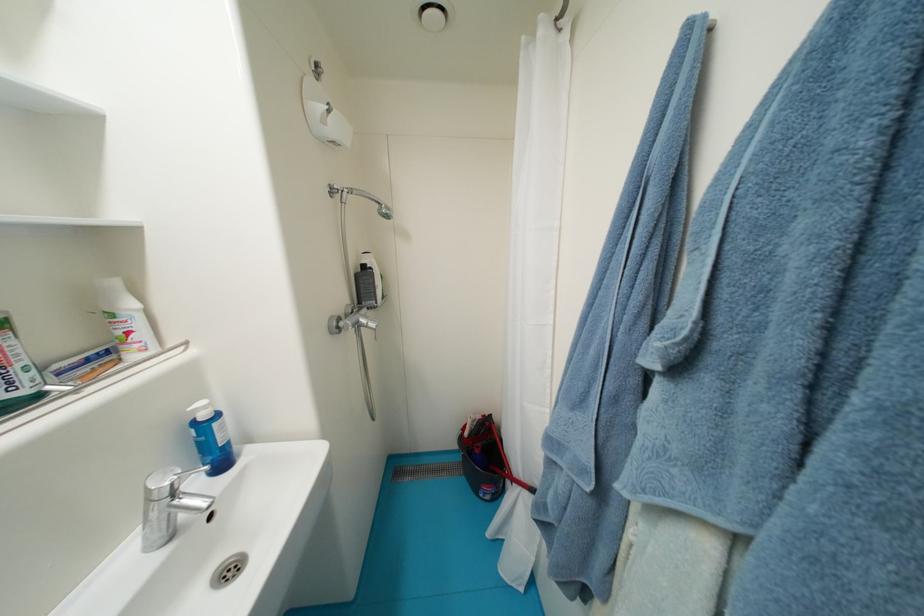
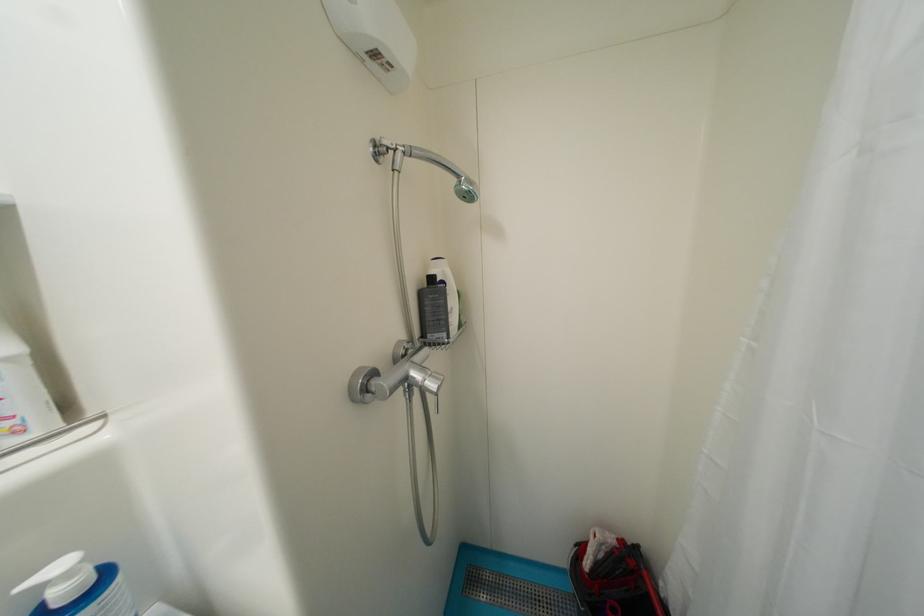
Where in the second image is the point corresponding to pixel 371 269 from the first image?

(439, 281)